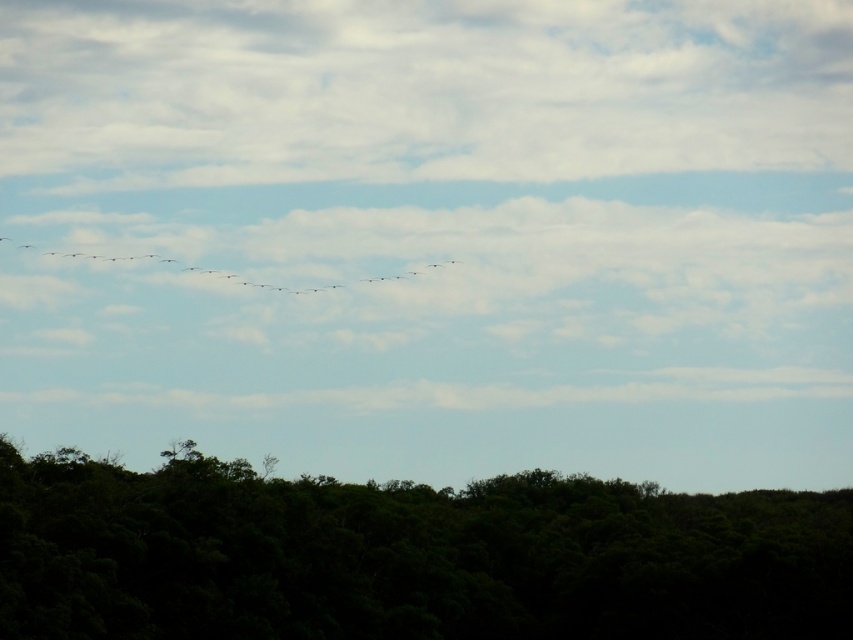
Looking at this image, which of these two, green leafy trees at lower center or silhouette feathered bird at left, stands shorter?

With less height is silhouette feathered bird at left.

Does point (804, 525) lie behind point (22, 244)?

That is False.

Identify the location of green leafy trees at lower center. (408, 556).

Is point (344, 556) positioned after point (134, 257)?

No, (344, 556) is in front of (134, 257).

Is green leafy trees at lower center bigger than gray matte birds at center?

Yes, green leafy trees at lower center is bigger than gray matte birds at center.

Is point (613, 595) less distant than point (234, 278)?

Yes.

Locate an element on the screen. green leafy trees at lower center is located at coordinates (408, 556).

Between gray matte birds at center and silhouette feathered bird at left, which one is positioned higher?

silhouette feathered bird at left is higher up.

Between point (99, 259) and point (16, 246), which one is positioned behind?

The point (16, 246) is behind.

At what (x,y) coordinates should I click in order to perform the action: click on gray matte birds at center. Please return your answer as a coordinate pair (x, y). Looking at the image, I should click on (238, 273).